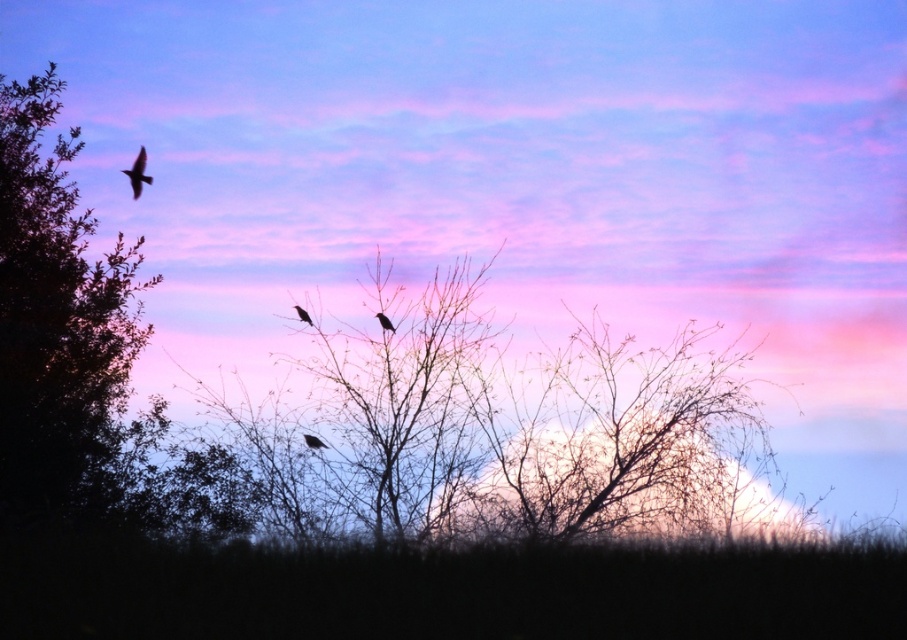
You are an ornithologist observing the sunset scene. You notice two birds in the image. Which bird has a larger width between the black matte bird at upper left and the silhouette feathered bird at center?

The black matte bird at upper left has a larger width than the silhouette feathered bird at center.

You are an ornithologist observing the sunset scene. You notice two birds, the black matte bird at upper left and the matte black bird at center. From your vantage point, which bird appears closer to you?

The black matte bird at upper left appears closer to you because the matte black bird at center is positioned behind it.

You are an ornithologist observing the sunset scene. You notice two birds, the black matte bird at upper left and the matte black bird at center. Based on their sizes in the image, which bird is closer to the observer?

The black matte bird at upper left is closer to the observer because it appears larger than the matte black bird at center, which is smaller and likely farther away.